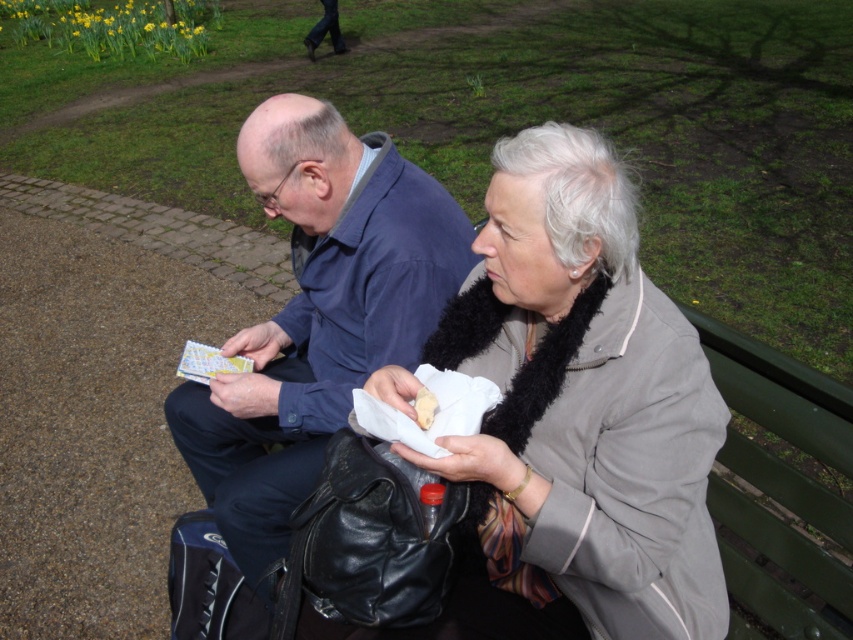
You are a park maintenance worker who needs to place a small trash can between the light gray fabric jacket at center and the blue fabric jacket at center. The trash can is 50 centimeters wide. Will it fit in the space between them?

The light gray fabric jacket at center is 48.51 centimeters away from blue fabric jacket at center. The trash can is 50 centimeters wide, which is slightly wider than the available space between them. Therefore, the trash can will not fit between the light gray fabric jacket at center and the blue fabric jacket at center.

You are a photographer trying to capture a candid shot of the blue fabric jacket at center and the white paper napkin at lower center. To ensure both subjects are in frame, you need to know their relative positions. Which object is positioned to the left of the other?

The blue fabric jacket at center is to the left of the white paper napkin at lower center.